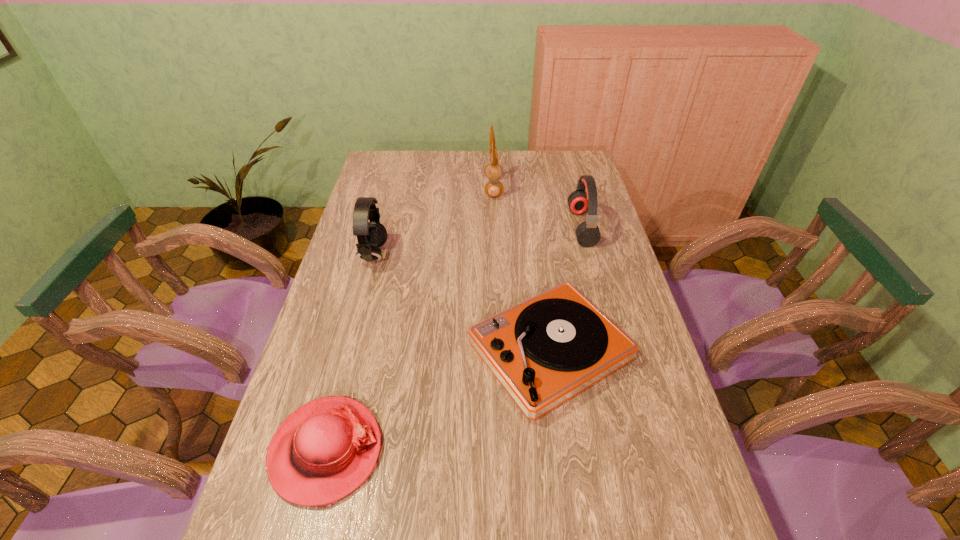
You are a GUI agent. You are given a task and a screenshot of the screen. Output one action in this format:
    pyautogui.click(x=<x>, y=<y>)
    Task: Click on the vacant space at the far edge of the desktop
    
    Given the screenshot: What is the action you would take?
    pyautogui.click(x=523, y=161)

In the image, there is a desktop. What are the coordinates of `free space at the left edge` in the screenshot? It's located at (357, 350).

At what (x,y) coordinates should I click in order to perform the action: click on free spot at the right edge of the desktop. Please return your answer as a coordinate pair (x, y). Looking at the image, I should click on (669, 422).

This screenshot has width=960, height=540. What are the coordinates of `free area in between the leftmost earphone and the record player` in the screenshot? It's located at (462, 303).

The width and height of the screenshot is (960, 540). I want to click on free space between the hat and the farthest earphone, so click(410, 319).

You are a GUI agent. You are given a task and a screenshot of the screen. Output one action in this format:
    pyautogui.click(x=<x>, y=<y>)
    Task: Click on the free spot between the rightmost earphone and the hat
    This screenshot has width=960, height=540.
    Given the screenshot: What is the action you would take?
    [x=454, y=339]

Identify the location of unoccupied area between the hat and the record player. The height and width of the screenshot is (540, 960). (438, 401).

Image resolution: width=960 pixels, height=540 pixels. Find the location of `unoccupied position between the rightmost earphone and the farthest object`. unoccupied position between the rightmost earphone and the farthest object is located at coordinates (538, 207).

This screenshot has width=960, height=540. I want to click on unoccupied position between the farthest object and the record player, so click(521, 269).

Locate an element on the screen. the third closest object relative to the rightmost earphone is located at coordinates (371, 235).